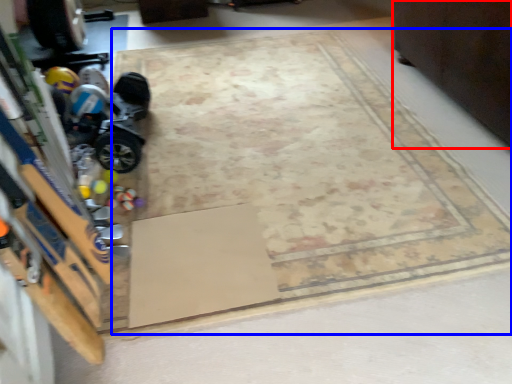
Question: Which point is further to the camera, furniture (highlighted by a red box) or mat (highlighted by a blue box)?

Choices:
 (A) furniture
 (B) mat

Answer: (A)